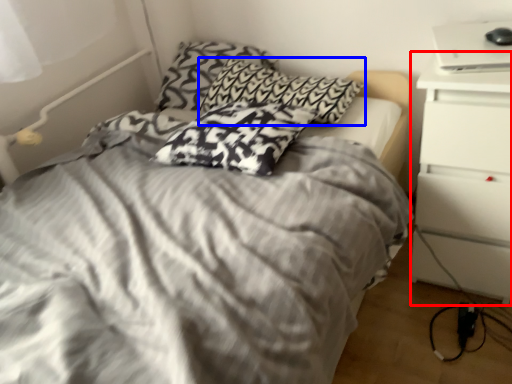
Question: Among these objects, which one is farthest to the camera, nightstand (highlighted by a red box) or pillow (highlighted by a blue box)?

Choices:
 (A) nightstand
 (B) pillow

Answer: (B)